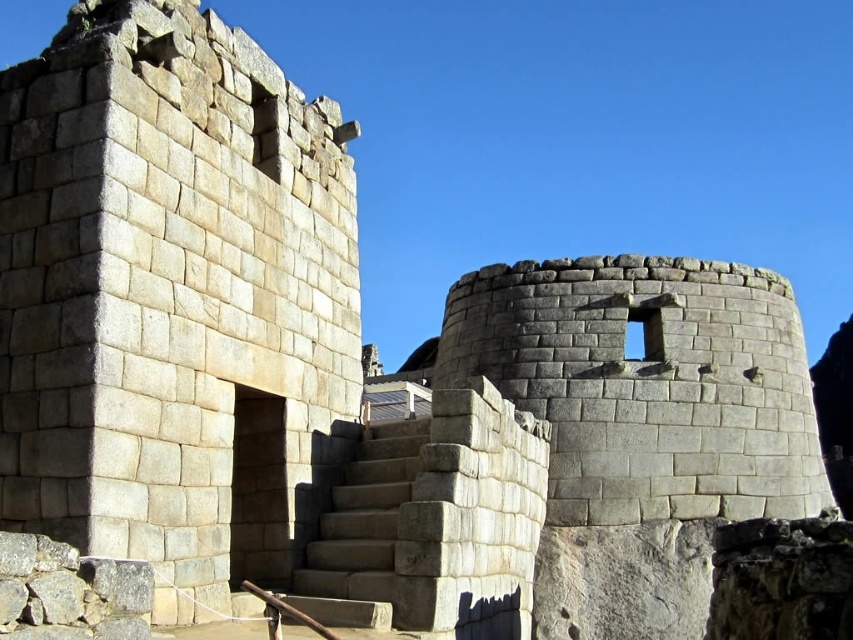
You are an archaeologist examining the ancient structures of Machu Picchu. You notice the gray stone wall at center and the gray stone stairs at center. Which of these two structures has a greater width?

The gray stone wall at center has a greater width than the gray stone stairs at center according to the description provided.

You are standing at the entrance of Machu Picchu and see the gray stone wall at center and the gray stone stairs at center. Which one is located to the left side?

The gray stone wall at center is positioned on the left side of gray stone stairs at center, so the gray stone wall at center is located to the left side.